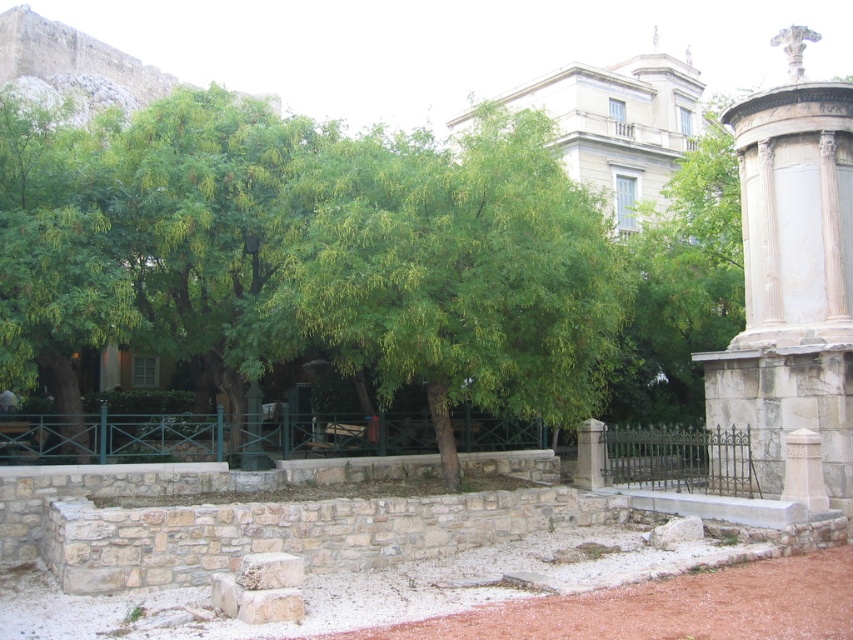
You are standing near the green metal fence and want to take a photo of both the green leafy tree at center and the white marble column at right. Which object should you position closer to the front of your camera frame to ensure both are fully visible in the photo?

Since the green leafy tree at center is much taller than the white marble column at right, you should position the white marble column at right closer to the front of your camera frame to balance their sizes in the photo.

You are standing at point (792, 275) in the scene. What object is located at this point?

The white marble column at right is located at point 0.430, 0.930.

You are standing in the historical park and see two points marked in the image. Which point is closer to you, point (393, 157) or point (828, 355)?

Point (393, 157) is closer to you because it is further to the viewer than point (828, 355).